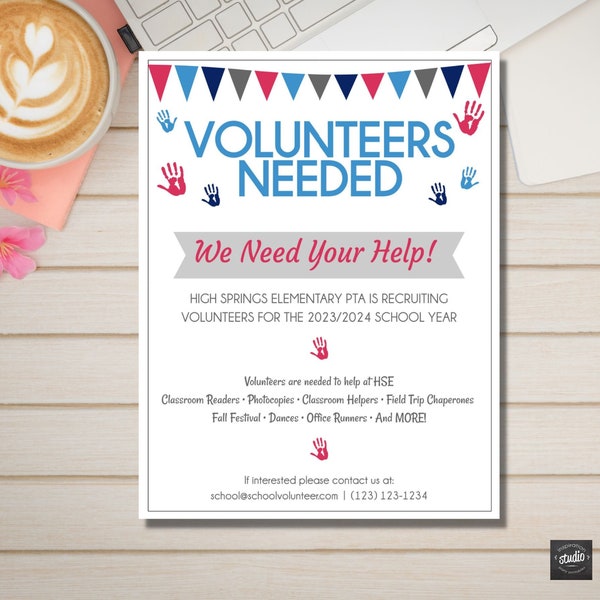
The height and width of the screenshot is (600, 600). In order to click on computer mouse in this screenshot , I will do `click(388, 34)`.